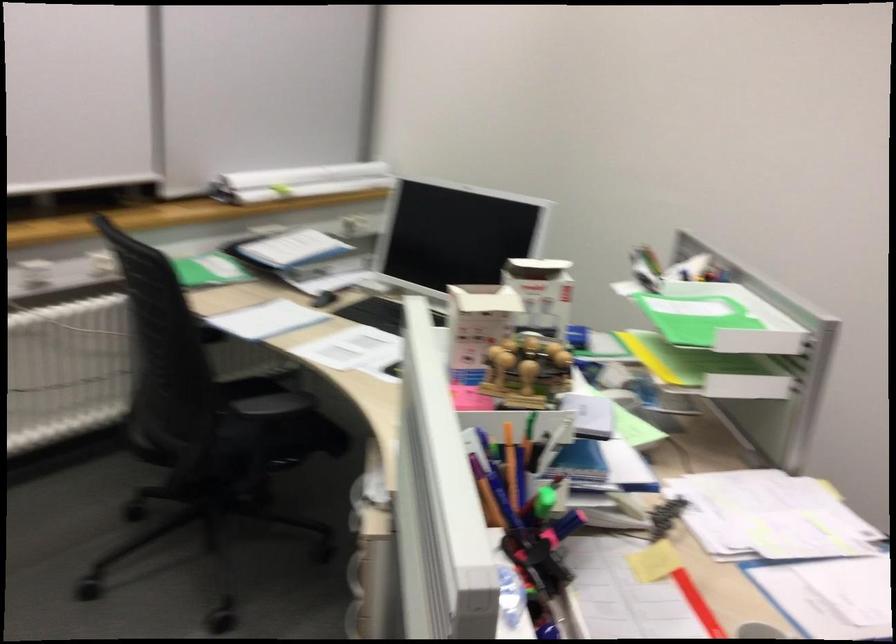
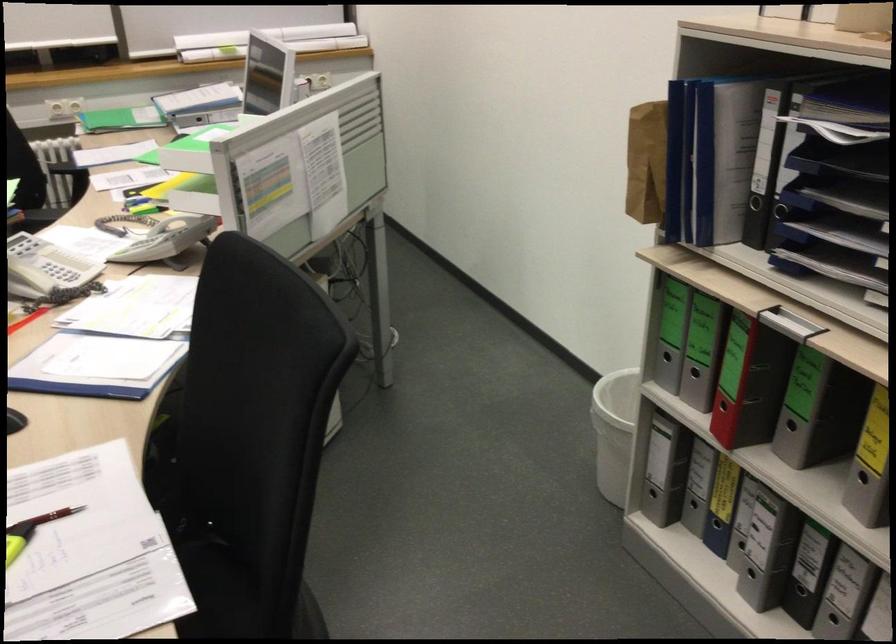
The point at (457,189) is marked in the first image. Where is the corresponding point in the second image?

(268, 41)